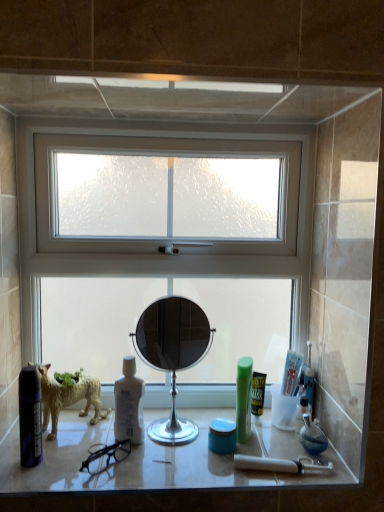
Question: Are green plastic mouthwash at right, the 1th mouthwash in the right-to-left sequence, and green plastic bottle at center-right located far from each other?

Choices:
 (A) no
 (B) yes

Answer: (A)

Question: Does green plastic mouthwash at right, the 1th mouthwash in the right-to-left sequence, have a greater height compared to green plastic bottle at center-right?

Choices:
 (A) no
 (B) yes

Answer: (A)

Question: Can you confirm if green plastic mouthwash at right, the 1th mouthwash in the right-to-left sequence, is wider than green plastic bottle at center-right?

Choices:
 (A) no
 (B) yes

Answer: (A)

Question: Is green plastic mouthwash at right, the 3th mouthwash positioned from the left, closer to the viewer compared to green plastic bottle at center-right?

Choices:
 (A) no
 (B) yes

Answer: (A)

Question: Is green plastic mouthwash at right, the 3th mouthwash positioned from the left, touching green plastic bottle at center-right?

Choices:
 (A) yes
 (B) no

Answer: (A)

Question: Considering the relative sizes of green plastic mouthwash at right, the 3th mouthwash positioned from the left, and green plastic bottle at center-right in the image provided, is green plastic mouthwash at right, the 3th mouthwash positioned from the left, shorter than green plastic bottle at center-right?

Choices:
 (A) yes
 (B) no

Answer: (A)

Question: From a real-world perspective, is blue matte jar at center, the second mouthwash positioned from the left, on green plastic mouthwash at right, the 3th mouthwash positioned from the left?

Choices:
 (A) no
 (B) yes

Answer: (A)

Question: Is blue matte jar at center, the second mouthwash positioned from the left, not within green plastic mouthwash at right, the 3th mouthwash positioned from the left?

Choices:
 (A) yes
 (B) no

Answer: (A)

Question: Is blue matte jar at center, the second mouthwash positioned from the left, turned away from green plastic mouthwash at right, the 3th mouthwash positioned from the left?

Choices:
 (A) yes
 (B) no

Answer: (B)

Question: Considering the relative sizes of blue matte jar at center, arranged as the second mouthwash when viewed from the right, and green plastic mouthwash at right, the 3th mouthwash positioned from the left, in the image provided, is blue matte jar at center, arranged as the second mouthwash when viewed from the right, wider than green plastic mouthwash at right, the 3th mouthwash positioned from the left,?

Choices:
 (A) no
 (B) yes

Answer: (B)

Question: From the image's perspective, is blue matte jar at center, arranged as the second mouthwash when viewed from the right, below green plastic mouthwash at right, the 1th mouthwash in the right-to-left sequence?

Choices:
 (A) no
 (B) yes

Answer: (B)

Question: Does blue matte jar at center, the second mouthwash positioned from the left, have a smaller size compared to green plastic mouthwash at right, the 1th mouthwash in the right-to-left sequence?

Choices:
 (A) yes
 (B) no

Answer: (B)

Question: Considering the relative sizes of green plastic mouthwash at right, the 3th mouthwash positioned from the left, and white frosted glass window at center in the image provided, is green plastic mouthwash at right, the 3th mouthwash positioned from the left, shorter than white frosted glass window at center?

Choices:
 (A) no
 (B) yes

Answer: (B)